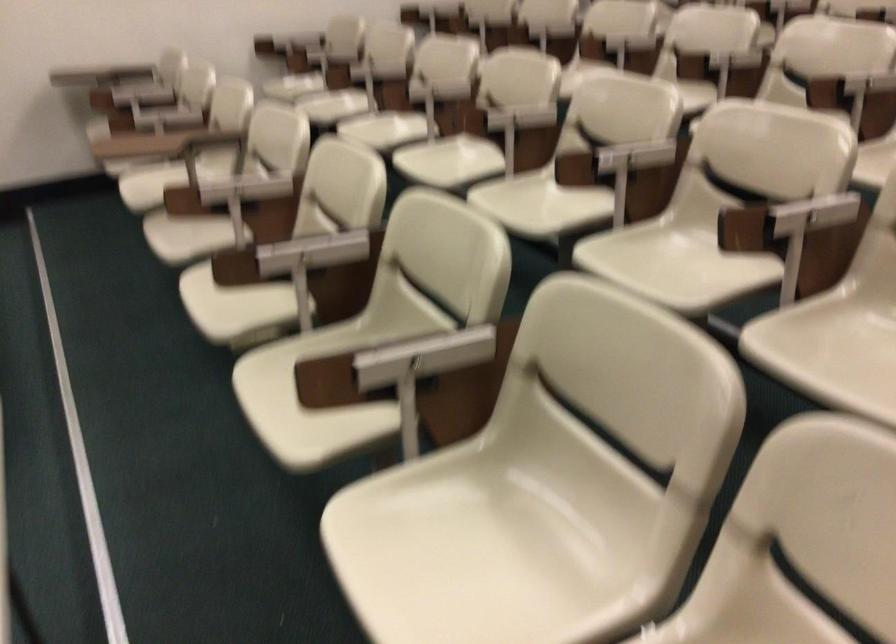
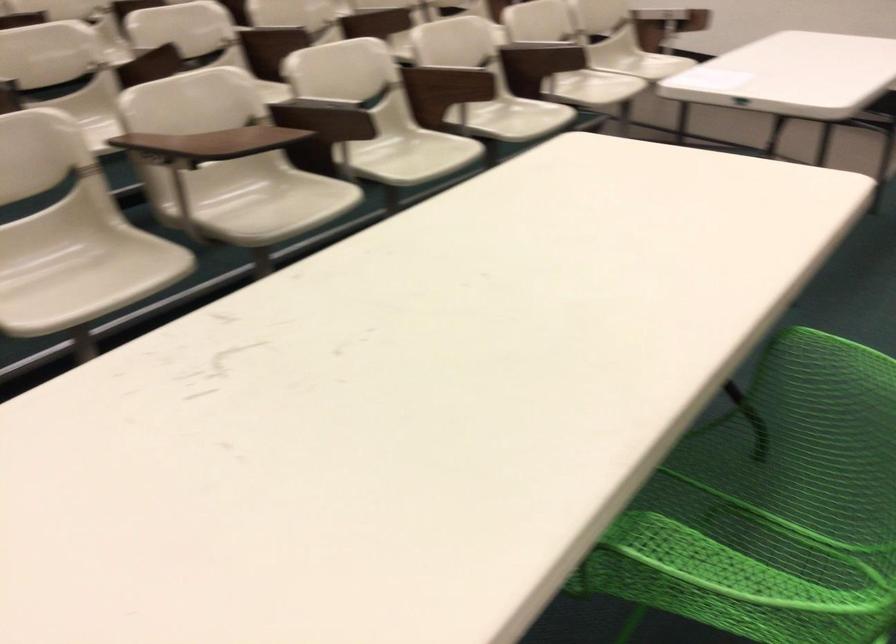
The point at (359, 308) is marked in the first image. Where is the corresponding point in the second image?

(405, 147)